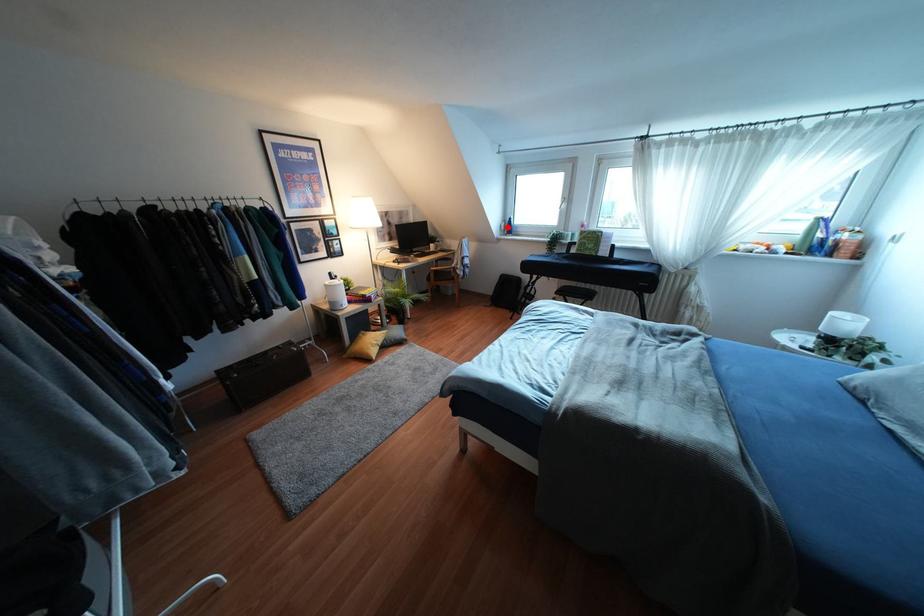
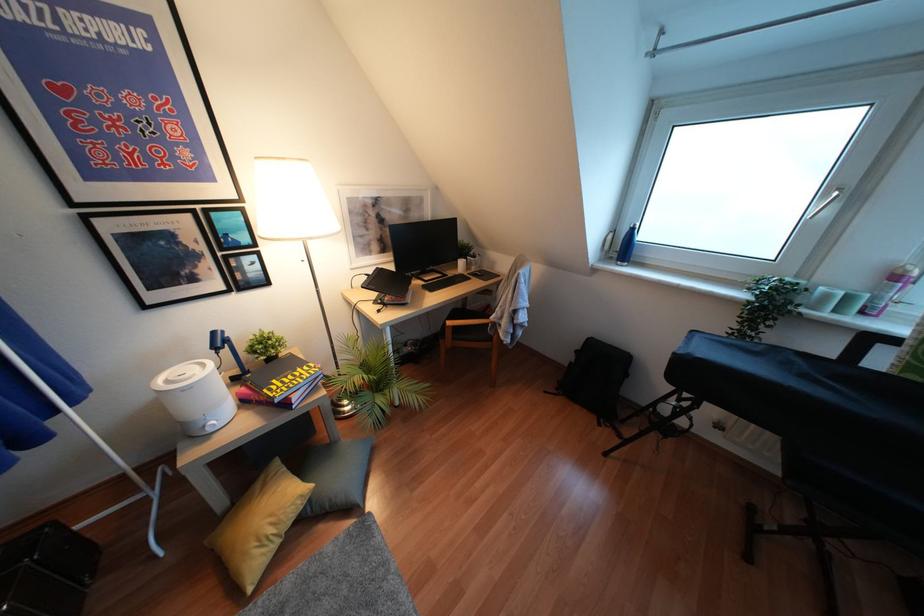
In the second image, find the point that corresponds to the highlighted location in the first image.

(623, 246)